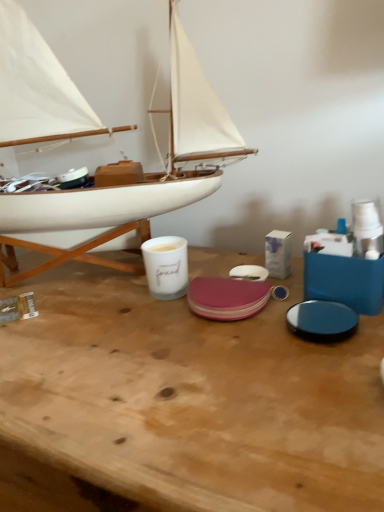
What are the coordinates of `white ceramic mug at center` in the screenshot? It's located at click(166, 266).

You are a GUI agent. You are given a task and a screenshot of the screen. Output one action in this format:
    pyautogui.click(x=<x>, y=<y>)
    Task: Click on the wooden table at center
    This screenshot has width=384, height=512.
    Given the screenshot: What is the action you would take?
    pyautogui.click(x=193, y=399)

What do you see at coordinates (36, 88) in the screenshot? This screenshot has height=512, width=384. I see `white wood boat at left` at bounding box center [36, 88].

Identify the location of white ceramic mug at center. (166, 266).

Does point (147, 327) appear closer or farther from the camera than point (159, 279)?

Point (147, 327) appears to be closer to the viewer than point (159, 279).

Between wooden table at center and white ceramic mug at center, which one appears on the left side from the viewer's perspective?

Positioned to the left is wooden table at center.

Considering the relative sizes of wooden table at center and white ceramic mug at center in the image provided, is wooden table at center shorter than white ceramic mug at center?

In fact, wooden table at center may be taller than white ceramic mug at center.

Who is smaller, white wood boat at left or white ceramic mug at center?

Smaller between the two is white ceramic mug at center.

Who is shorter, white wood boat at left or white ceramic mug at center?

white ceramic mug at center.

Is white wood boat at left directly adjacent to white ceramic mug at center?

No, white wood boat at left is not in contact with white ceramic mug at center.

Which object is positioned more to the right, white wood boat at left or white ceramic mug at center?

From the viewer's perspective, white ceramic mug at center appears more on the right side.

From a real-world perspective, is wooden table at center located beneath white wood boat at left?

Yes, from a real-world perspective, wooden table at center is under white wood boat at left.

Is wooden table at center to the left of white wood boat at left from the viewer's perspective?

In fact, wooden table at center is to the right of white wood boat at left.

How different are the orientations of wooden table at center and white wood boat at left in degrees?

The angle between the facing direction of wooden table at center and the facing direction of white wood boat at left is 0.266 degrees.

Is wooden table at center bigger or smaller than white wood boat at left?

Clearly, wooden table at center is larger in size than white wood boat at left.

Considering the relative sizes of white ceramic mug at center and white wood boat at left in the image provided, is white ceramic mug at center bigger than white wood boat at left?

No, white ceramic mug at center is not bigger than white wood boat at left.

Consider the image. Is white ceramic mug at center far away from white wood boat at left?

They are positioned close to each other.

From the image's perspective, would you say white ceramic mug at center is shown under white wood boat at left?

Yes.

Does white ceramic mug at center turn towards wooden table at center?

No.

Which object is thinner, white ceramic mug at center or wooden table at center?

white ceramic mug at center is thinner.

Can you tell me how much white ceramic mug at center and wooden table at center differ in facing direction?

The angle between the facing direction of white ceramic mug at center and the facing direction of wooden table at center is 8.4 degrees.

Is there a large distance between white ceramic mug at center and wooden table at center?

No, white ceramic mug at center is in close proximity to wooden table at center.

Who is taller, white wood boat at left or wooden table at center?

white wood boat at left.

Visually, is white wood boat at left positioned to the left or to the right of wooden table at center?

In the image, white wood boat at left appears on the left side of wooden table at center.

In terms of width, does white wood boat at left look wider or thinner when compared to wooden table at center?

Clearly, white wood boat at left has less width compared to wooden table at center.

Can you tell me how much white wood boat at left and wooden table at center differ in facing direction?

There is a 0.266-degree angle between the facing directions of white wood boat at left and wooden table at center.

In the image, there is a white ceramic mug at center. At what (x,y) coordinates should I click in order to perform the action: click on table below it (from a real-world perspective). Please return your answer as a coordinate pair (x, y). This screenshot has height=512, width=384. Looking at the image, I should click on (193, 399).

I want to click on boat above the white ceramic mug at center (from a real-world perspective), so click(x=36, y=88).

Which object lies nearer to the anchor point wooden table at center, white ceramic mug at center or white wood boat at left?

white ceramic mug at center is closer to wooden table at center.

Looking at the image, which one is located further to white ceramic mug at center, white wood boat at left or wooden table at center?

white wood boat at left.

Which object lies nearer to the anchor point white wood boat at left, wooden table at center or white ceramic mug at center?

Among the two, white ceramic mug at center is located nearer to white wood boat at left.

Estimate the real-world distances between objects in this image. Which object is further from white wood boat at left, white ceramic mug at center or wooden table at center?

Based on the image, wooden table at center appears to be further to white wood boat at left.

From the picture: Based on their spatial positions, is wooden table at center or white wood boat at left closer to white ceramic mug at center?

Among the two, wooden table at center is located nearer to white ceramic mug at center.

When comparing their distances from wooden table at center, does white wood boat at left or white ceramic mug at center seem further?

The object further to wooden table at center is white wood boat at left.

You are a GUI agent. You are given a task and a screenshot of the screen. Output one action in this format:
    pyautogui.click(x=<x>, y=<y>)
    Task: Click on the tableware between white wood boat at left and wooden table at center vertically
    
    Given the screenshot: What is the action you would take?
    pyautogui.click(x=166, y=266)